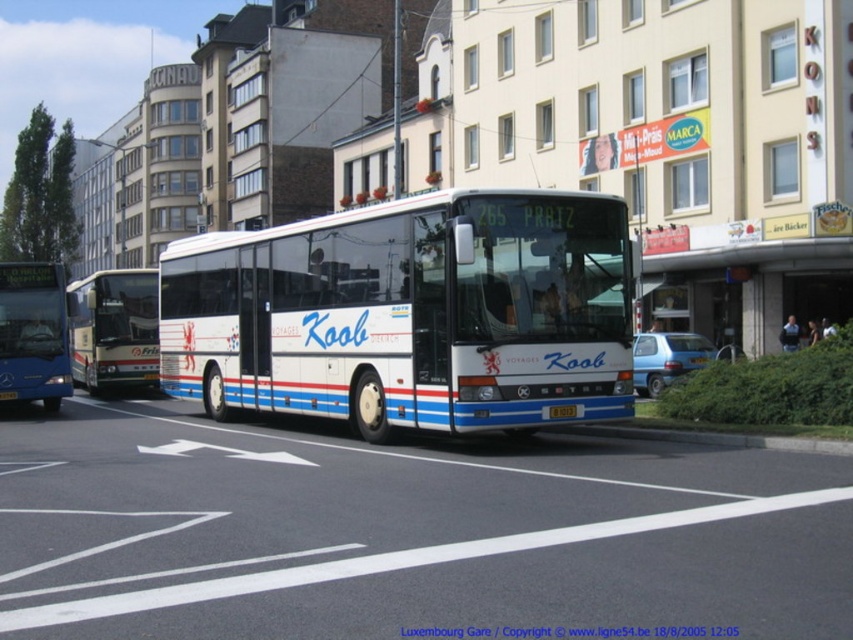
You are a delivery person who needs to place a rectangular box that is 12 feet long between the white glossy bus at center and the yellow metallic license plate at center. Can you fit the box between them without overlapping either object?

The distance between the white glossy bus at center and the yellow metallic license plate at center is 11.47 feet. Since the box is 12 feet long, it is longer than the available space, so it cannot be placed between them without overlapping either object.

You are standing on the sidewalk and want to cross the street to reach the white glossy bus at center. The crosswalk is 12 meters away from you. Can you safely reach the bus before the crosswalk ends?

The white glossy bus at center is 11.06 meters away from you, which is shorter than the 12 meters crosswalk. Therefore, you can safely reach the bus before the crosswalk ends.

You are a delivery driver who needs to park your truck exactly at the center of the road. The road has a white glossy bus at center. Where should you park your truck?

The white glossy bus at center is already positioned at the center of the road at point (x=409, y=314), so you should park your truck at that same location.